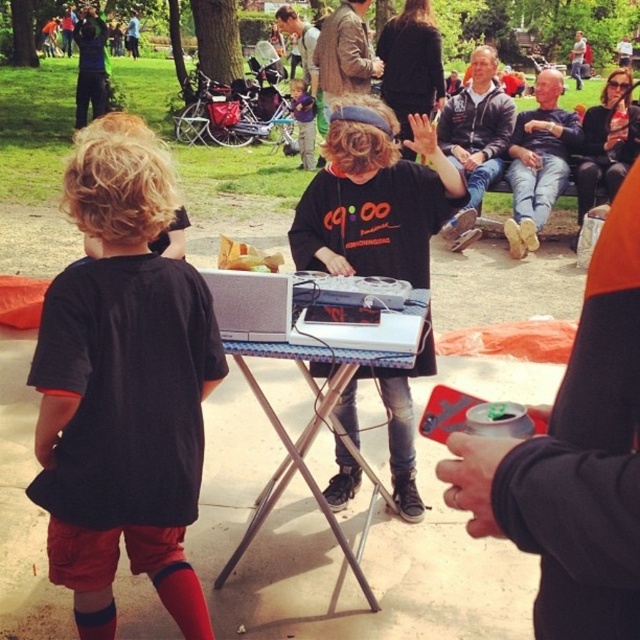
You are a photographer standing at the back of the park. You want to take a photo of the denim jeans at center and the brown leather jacket at upper center. Can you fit both of them in the frame if your camera has a 1.8 meter wide field of view?

The denim jeans at center and brown leather jacket at upper center are 1.74 meters apart, so yes, the camera with a 1.8 meter wide field of view can capture both in the frame since the distance between them is less than the field of view.

You are a photographer setting up a shoot at the park. You need to position a tripod so that both the denim jeans at center and the brown leather jacket at upper center are in the frame. Which object should you place closer to the camera to ensure both are visible without zooming?

The denim jeans at center is smaller than the brown leather jacket at upper center, so you should place the denim jeans at center closer to the camera to make it appear larger and balance the sizes in the frame.

You are a photographer trying to capture the best shot of the two points in the scene. Which point, point (314,365) or point (333,17), would appear larger in your photo?

Point (314,365) is closer to the camera than point (333,17), so it would appear larger in the photo.